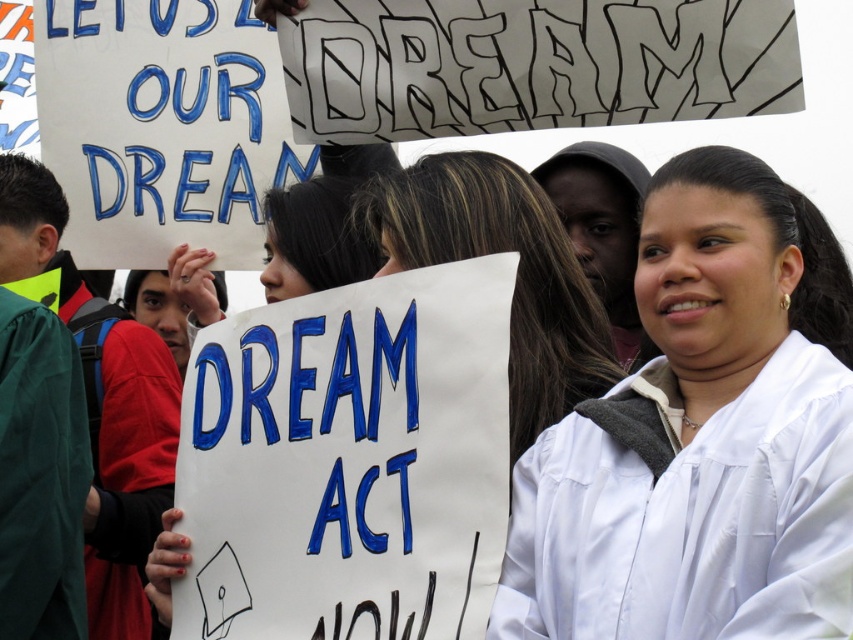
You are a photographer at the protest and want to capture both the white satin graduation gown at center and the white matte graduation gown at center in a single frame. Which gown should you focus on to ensure both are visible without cropping?

The white satin graduation gown at center is bigger than the white matte graduation gown at center, so focusing on the larger one will ensure both are visible in the frame.

You are a photographer at the protest and want to take a photo that includes both the white satin graduation gown at center and the white matte graduation gown at center. Which one should you focus on first if you want to capture them from left to right order?

The white satin graduation gown at center is positioned on the right side of white matte graduation gown at center, so you should focus on the white matte graduation gown at center first to capture them from left to right order.